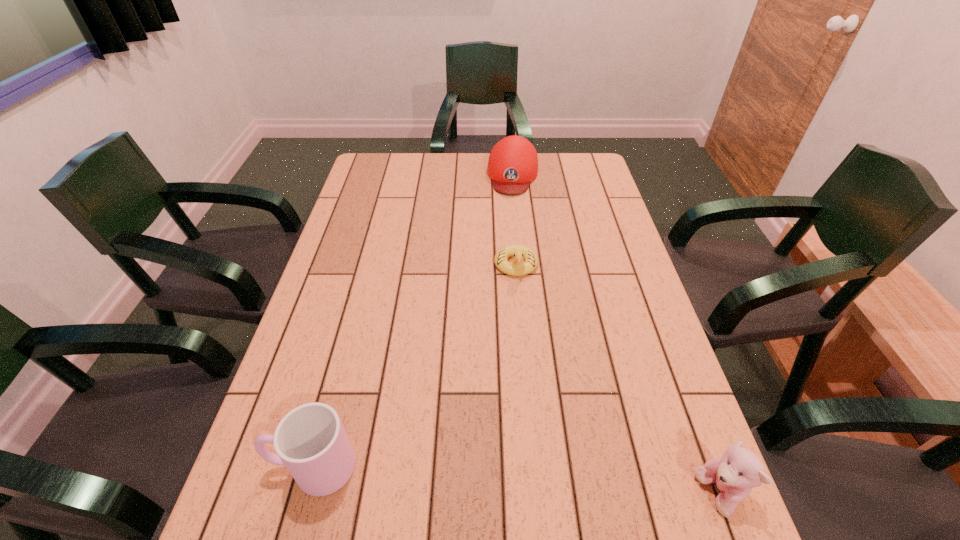
Identify the location of free spot on the desktop that is between the cup and the rightmost object and is positioned on the front-facing side of the farthest object. (479, 478).

At what (x,y) coordinates should I click in order to perform the action: click on vacant space on the desktop that is between the leftmost object and the teddy bear and is positioned on the face of the shortest object. Please return your answer as a coordinate pair (x, y). Looking at the image, I should click on (523, 481).